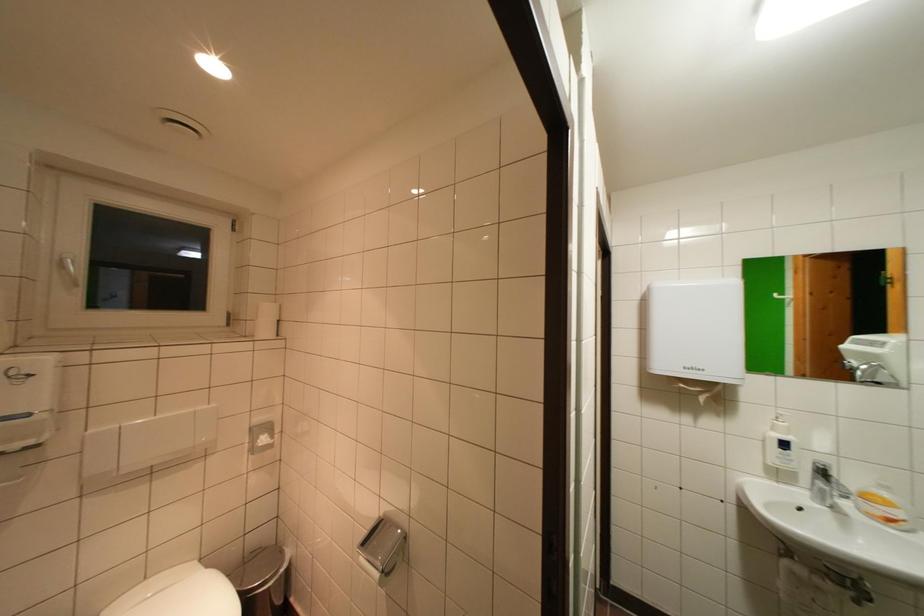
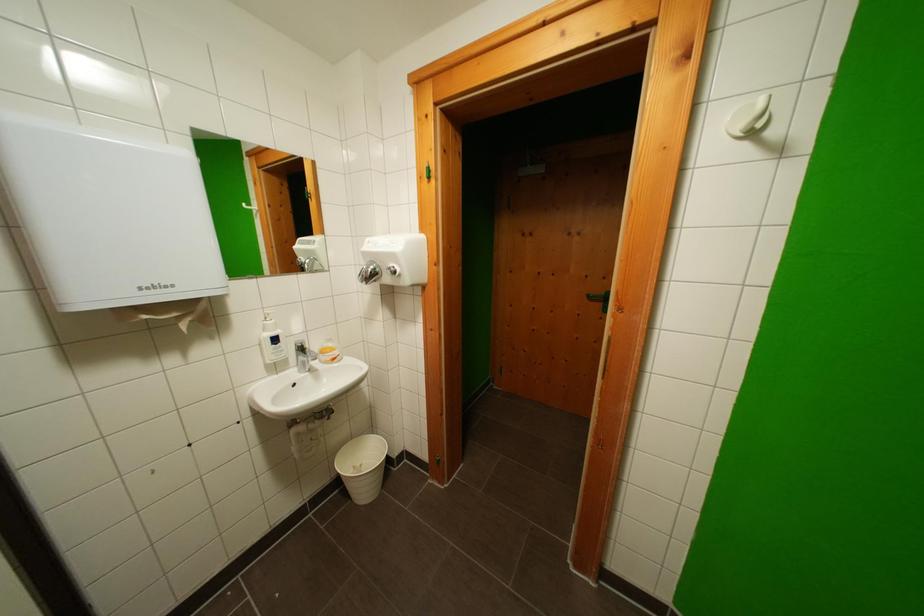
First-person continuous shooting, in which direction is the camera rotating?

The camera rotated toward right-down.